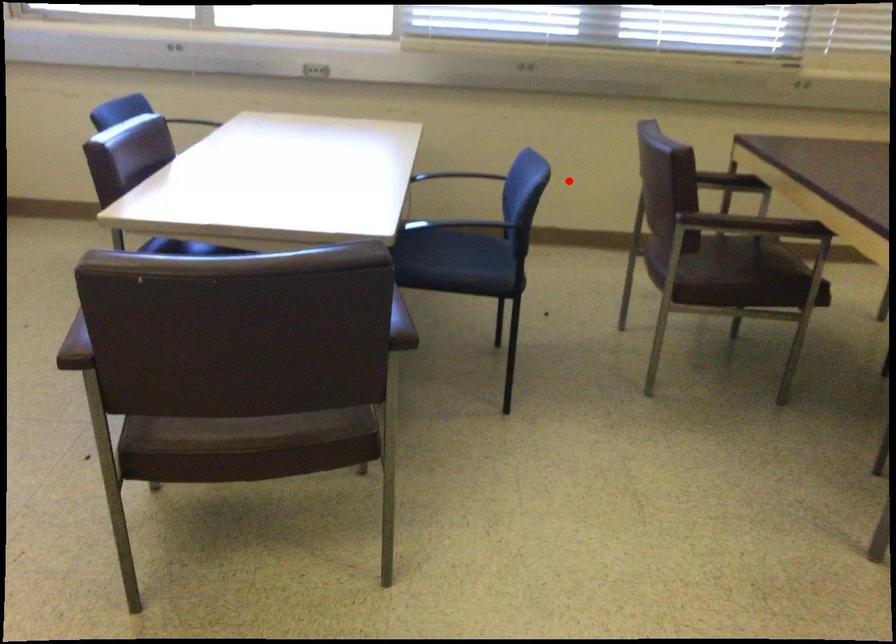
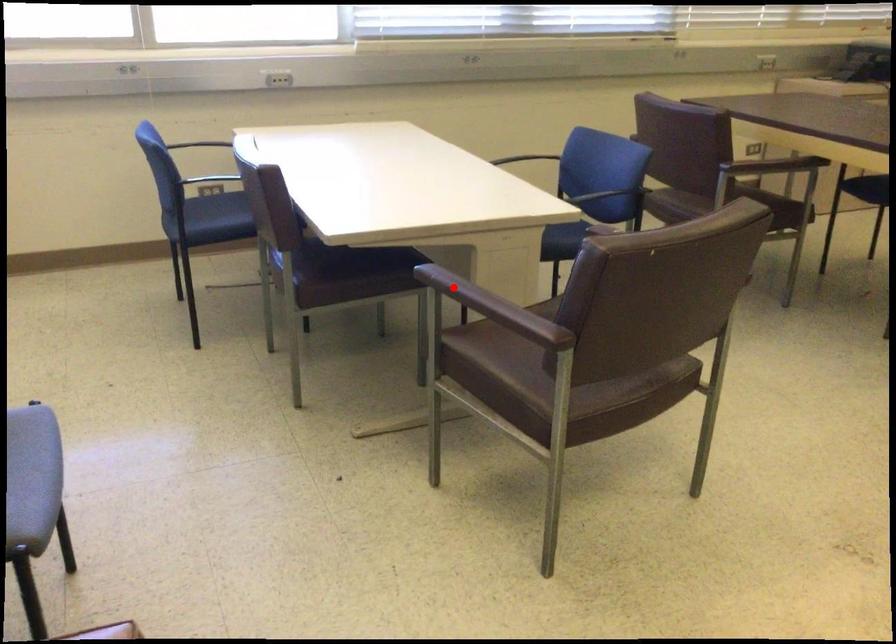
I am providing you with two images of the same scene from different viewpoints. A red point is marked on the first image and another point is marked on the second image. Do the highlighted points in image1 and image2 indicate the same real-world spot?

No